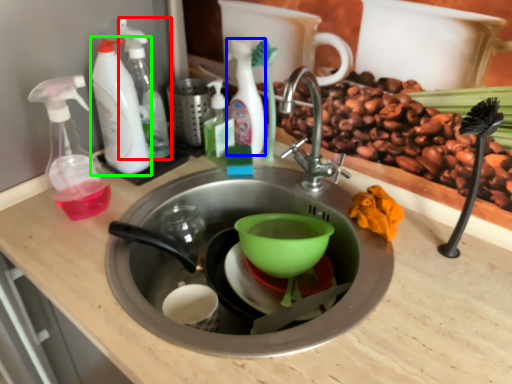
Question: Estimate the real-world distances between objects in this image. Which object is farther from cleaning product (highlighted by a red box), cleaning product (highlighted by a blue box) or cleaning product (highlighted by a green box)?

Choices:
 (A) cleaning product
 (B) cleaning product

Answer: (A)